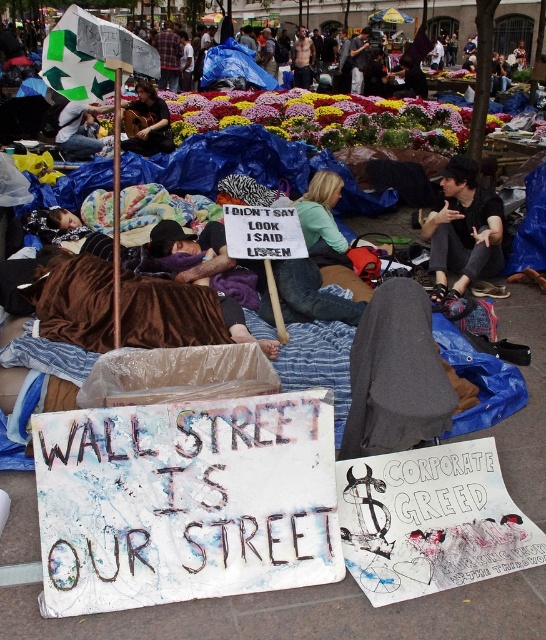
Question: Can you confirm if black leather jacket at center is smaller than green fabric shirt at center?

Choices:
 (A) yes
 (B) no

Answer: (B)

Question: Is white cardboard sign at center behind black leather jacket at center?

Choices:
 (A) no
 (B) yes

Answer: (A)

Question: Estimate the real-world distances between objects in this image. Which object is closer to the green fabric shirt at center?

Choices:
 (A) black leather jacket at center
 (B) green fabric sign at upper left

Answer: (A)

Question: Which object is farther from the camera taking this photo?

Choices:
 (A) green fabric sign at upper left
 (B) green fabric shirt at center
 (C) white cardboard sign at center

Answer: (A)

Question: Which of the following is the farthest from the observer?

Choices:
 (A) (97, 106)
 (B) (437, 282)
 (C) (181, 561)

Answer: (B)

Question: Can you confirm if white cardboard sign at center is wider than matte brown guitar at upper left?

Choices:
 (A) yes
 (B) no

Answer: (A)